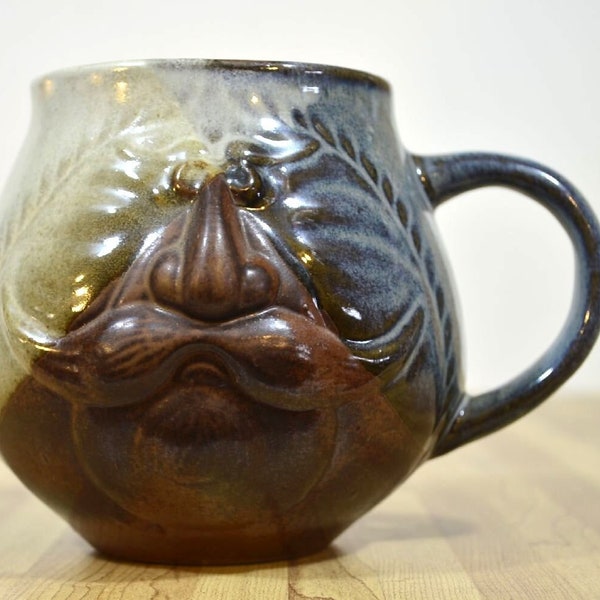
The image size is (600, 600). Find the location of `handle`. handle is located at coordinates (586, 215).